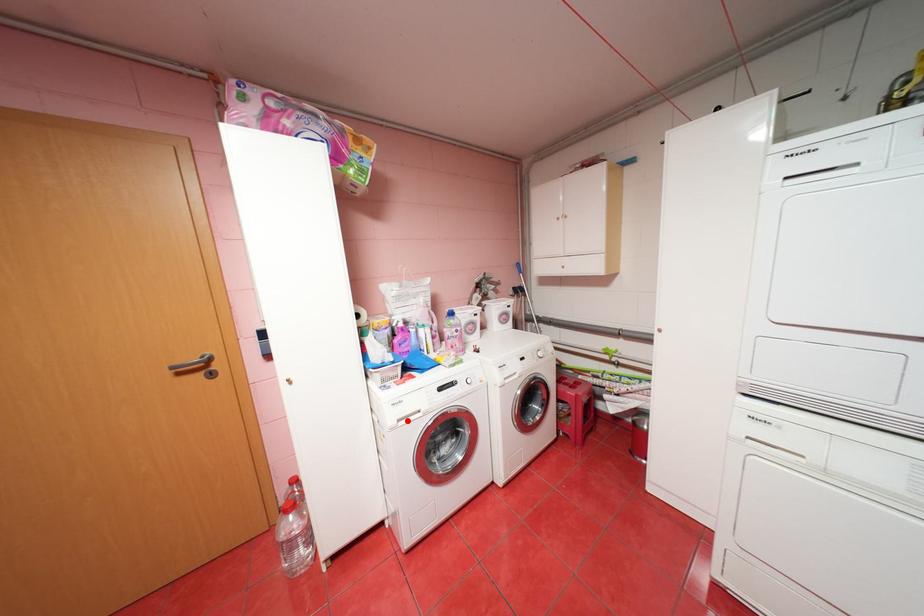
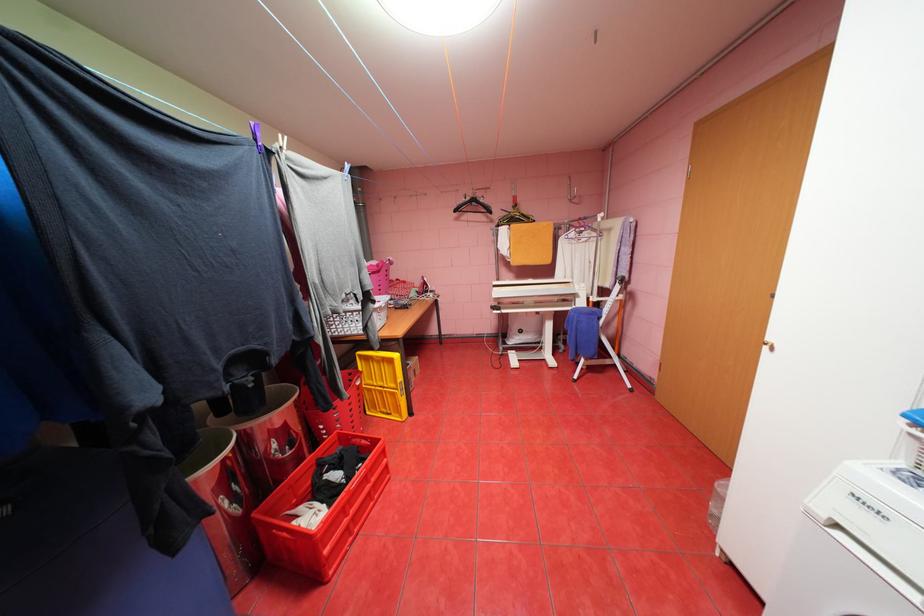
Find the pixel in the second image that matches the highlighted location in the first image.

(845, 525)